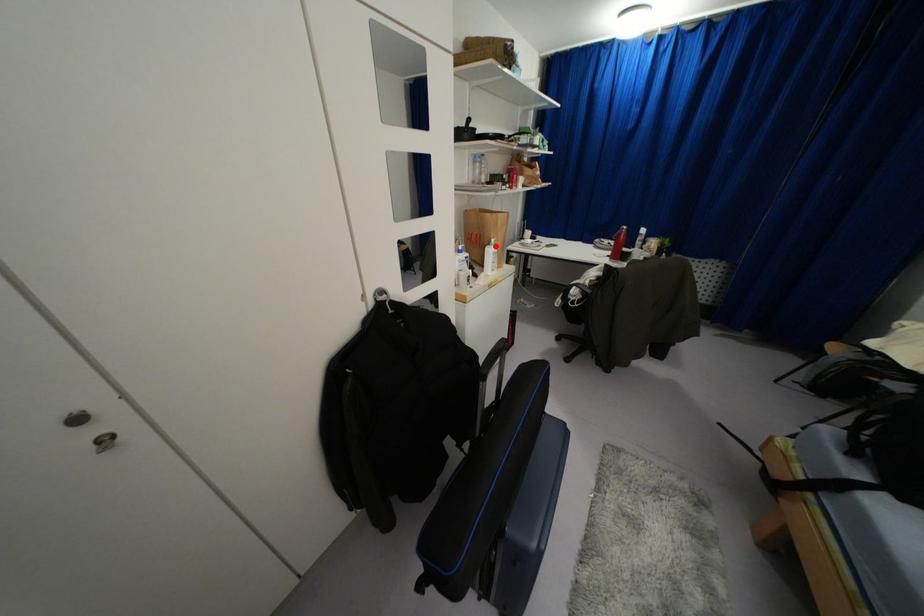
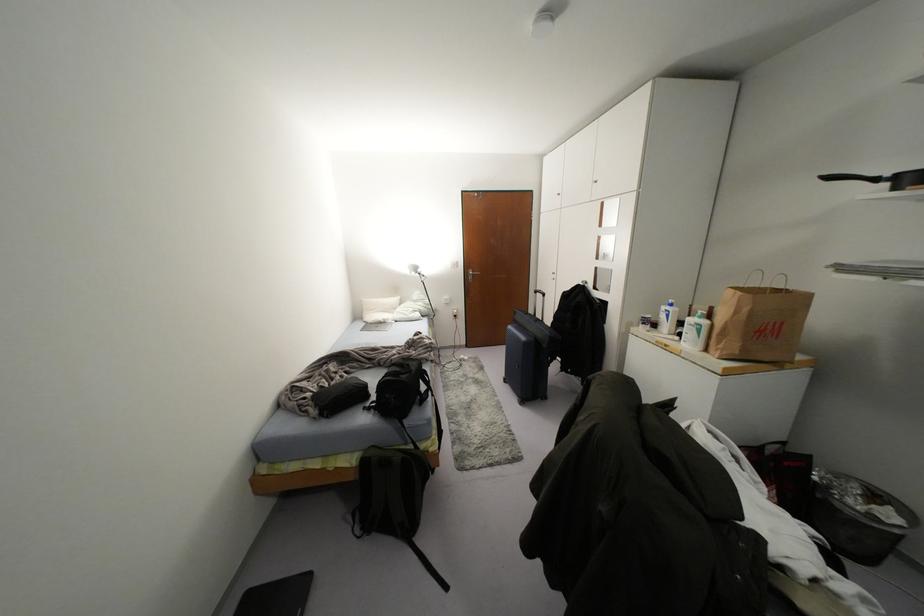
In the second image, find the point that corresponds to the highlighted location in the first image.

(703, 322)